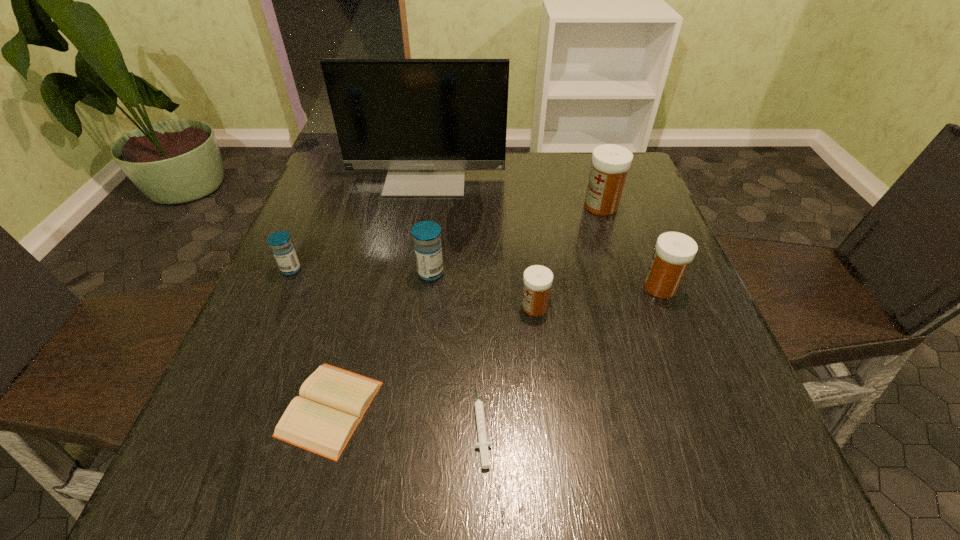
Image resolution: width=960 pixels, height=540 pixels. In order to click on empty space between the third object from right to left and the tallest object in this screenshot , I will do `click(480, 241)`.

This screenshot has width=960, height=540. I want to click on blank region between the smallest white medicine and the second shortest object, so click(432, 357).

The height and width of the screenshot is (540, 960). Find the location of `the fourth closest object to the farthest medicine`. the fourth closest object to the farthest medicine is located at coordinates (427, 244).

Identify which object is the fifth nearest to the computer monitor. Please provide its 2D coordinates. Your answer should be formatted as a tuple, i.e. [(x, y)], where the tuple contains the x and y coordinates of a point satisfying the conditions above.

[(674, 251)]

Select which medicine appears as the closest to the tallest object. Please provide its 2D coordinates. Your answer should be formatted as a tuple, i.e. [(x, y)], where the tuple contains the x and y coordinates of a point satisfying the conditions above.

[(610, 163)]

Locate an element on the screen. This screenshot has width=960, height=540. medicine that can be found as the closest to the second biggest white medicine is located at coordinates (610, 163).

Select which white medicine is the second closest to the second biggest white medicine. Please provide its 2D coordinates. Your answer should be formatted as a tuple, i.e. [(x, y)], where the tuple contains the x and y coordinates of a point satisfying the conditions above.

[(537, 279)]

Image resolution: width=960 pixels, height=540 pixels. In order to click on the third closest white medicine to the diary in this screenshot , I will do `click(610, 163)`.

You are a GUI agent. You are given a task and a screenshot of the screen. Output one action in this format:
    pyautogui.click(x=<x>, y=<y>)
    Task: Click on the vacant position in the image that satisfies the following two spatial constraints: 1. on the screen of the leftmost white medicine; 2. on the left side of the computer monitor
    Image resolution: width=960 pixels, height=540 pixels.
    Given the screenshot: What is the action you would take?
    pyautogui.click(x=405, y=307)

Locate an element on the screen. blank area in the image that satisfies the following two spatial constraints: 1. on the screen of the sixth object from left to right; 2. on the left side of the tallest object is located at coordinates (405, 307).